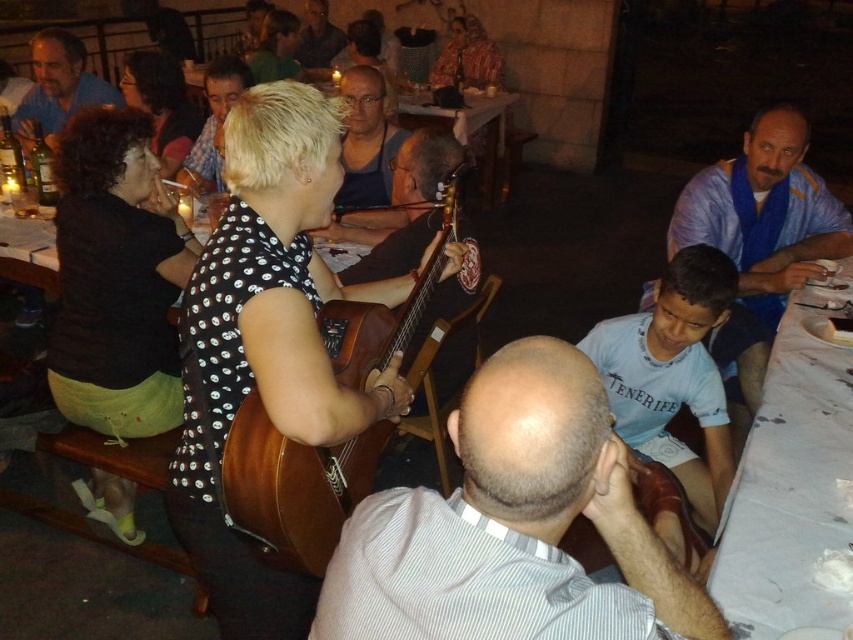
Looking at this image, you are a photographer at the event and want to capture a photo of the woman playing the acoustic guitar and the light blue cotton shirt at lower right in the same frame. The camera you are using has a maximum focus range of 6 feet. Can you take the photo without moving either subject?

The distance between the woman playing the acoustic guitar and the light blue cotton shirt at lower right is 6.35 feet. Since the camera can only focus within 6 feet, the subjects are slightly too far apart for the photo to be in focus without moving them.

In the scene of the lively outdoor gathering, you notice a woman playing an acoustic guitar. She is wearing a black dress with white polka dots and has short blonde hair. There is also a striped shirt visible. Based on the spatial arrangement, can you determine whether the striped shirt at center is positioned to the left or right of the blonde hair at center?

The striped shirt at center is to the right of the blonde hair at center.

You are standing in the crowd watching the performance. There are two points marked in the image. One is at coordinates point (422, 320) and the other is at point (639, 337). Which point is closer to you?

Point (422, 320) is closer to you because it is further to the camera than point (639, 337).